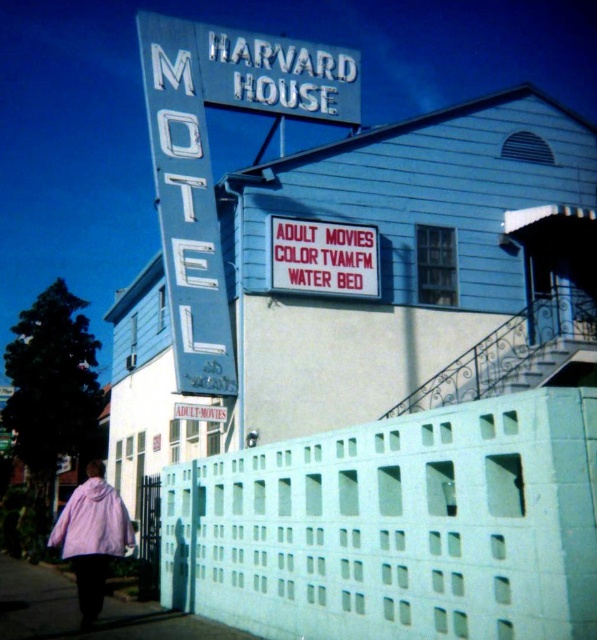
You are standing at the Harvard House Motel and want to know the exact location of the smooth concrete pavement at lower left. What are its coordinates?

The smooth concrete pavement at lower left is located at coordinates point (78, 611).

You are standing at the entrance of the Harvard House Motel and see the light blue concrete fence at lower center and the pink fuzzy coat at lower left. Which object is positioned higher from the ground?

The light blue concrete fence at lower center is above the pink fuzzy coat at lower left, so it is positioned higher from the ground.

From the picture: You are a delivery person trying to park your 1.2 meter wide delivery van near the Harvard House Motel. You see the smooth concrete pavement at lower left and the pink fabric coat at lower left. Which area can accommodate your van?

The smooth concrete pavement at lower left has a larger width than the pink fabric coat at lower left, so the van can park on the smooth concrete pavement at lower left.